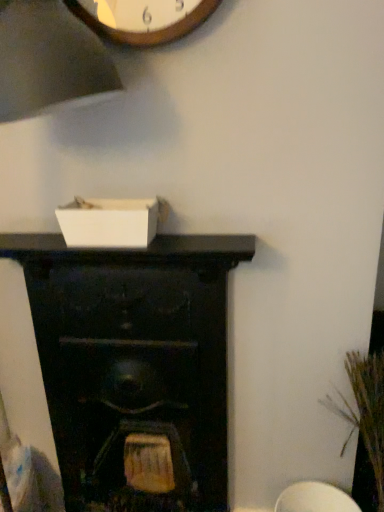
This screenshot has width=384, height=512. What do you see at coordinates (134, 361) in the screenshot? I see `black wood fireplace at center` at bounding box center [134, 361].

Image resolution: width=384 pixels, height=512 pixels. Find the location of `black wood fireplace at center`. black wood fireplace at center is located at coordinates pyautogui.click(x=134, y=361).

This screenshot has height=512, width=384. What do you see at coordinates (365, 411) in the screenshot?
I see `brown textured plant at right` at bounding box center [365, 411].

Where is `brown textured plant at right`? This screenshot has width=384, height=512. brown textured plant at right is located at coordinates (365, 411).

Locate an element on the screen. The height and width of the screenshot is (512, 384). black wood fireplace at center is located at coordinates (134, 361).

Considering the positions of objects black wood fireplace at center and brown textured plant at right in the image provided, who is more to the left, black wood fireplace at center or brown textured plant at right?

Positioned to the left is black wood fireplace at center.

Does black wood fireplace at center lie behind brown textured plant at right?

Yes, it is behind brown textured plant at right.

Is point (210, 509) less distant than point (371, 446)?

No, it is behind (371, 446).

From the image's perspective, does black wood fireplace at center appear higher than brown textured plant at right?

Correct, black wood fireplace at center appears higher than brown textured plant at right in the image.

From a real-world perspective, is black wood fireplace at center positioned above or below brown textured plant at right?

black wood fireplace at center is situated higher than brown textured plant at right in the real world.

Which object is thinner, black wood fireplace at center or brown textured plant at right?

black wood fireplace at center.

Does black wood fireplace at center have a lesser height compared to brown textured plant at right?

No.

Between black wood fireplace at center and brown textured plant at right, which one has smaller size?

brown textured plant at right.

Is black wood fireplace at center inside or outside of brown textured plant at right?

black wood fireplace at center is not enclosed by brown textured plant at right.

Are black wood fireplace at center and brown textured plant at right far apart?

They are positioned close to each other.

Could you tell me if black wood fireplace at center is turned towards brown textured plant at right?

No, black wood fireplace at center does not turn towards brown textured plant at right.

Looking at this image, measure the distance between black wood fireplace at center and brown textured plant at right.

A distance of 59.24 centimeters exists between black wood fireplace at center and brown textured plant at right.

Where is `plant below the black wood fireplace at center (from a real-world perspective)`? This screenshot has width=384, height=512. plant below the black wood fireplace at center (from a real-world perspective) is located at coordinates (365, 411).

Considering the relative positions of brown textured plant at right and black wood fireplace at center in the image provided, is brown textured plant at right to the left or to the right of black wood fireplace at center?

In the image, brown textured plant at right appears on the right side of black wood fireplace at center.

Is brown textured plant at right further to the viewer compared to black wood fireplace at center?

That is False.

Does point (355, 397) come behind point (204, 494)?

That is False.

From the image's perspective, does brown textured plant at right appear higher than black wood fireplace at center?

No, from the image's perspective, brown textured plant at right is not over black wood fireplace at center.

From a real-world perspective, is brown textured plant at right positioned over black wood fireplace at center based on gravity?

Actually, brown textured plant at right is physically below black wood fireplace at center in the real world.

Which object is thinner, brown textured plant at right or black wood fireplace at center?

Thinner between the two is black wood fireplace at center.

Considering the sizes of brown textured plant at right and black wood fireplace at center in the image, is brown textured plant at right taller or shorter than black wood fireplace at center?

brown textured plant at right is shorter than black wood fireplace at center.

Who is bigger, brown textured plant at right or black wood fireplace at center?

black wood fireplace at center is bigger.

Is black wood fireplace at center inside brown textured plant at right?

No, black wood fireplace at center is not a part of brown textured plant at right.

Is brown textured plant at right touching black wood fireplace at center?

There is a gap between brown textured plant at right and black wood fireplace at center.

Is brown textured plant at right aimed at black wood fireplace at center?

No, brown textured plant at right is not facing towards black wood fireplace at center.

Where is `fireplace on the left of brown textured plant at right`? Image resolution: width=384 pixels, height=512 pixels. fireplace on the left of brown textured plant at right is located at coordinates (134, 361).

Locate an element on the screen. The image size is (384, 512). plant in front of the black wood fireplace at center is located at coordinates (365, 411).

Find the location of a particular element. This screenshot has width=384, height=512. plant that is below the black wood fireplace at center (from the image's perspective) is located at coordinates (365, 411).